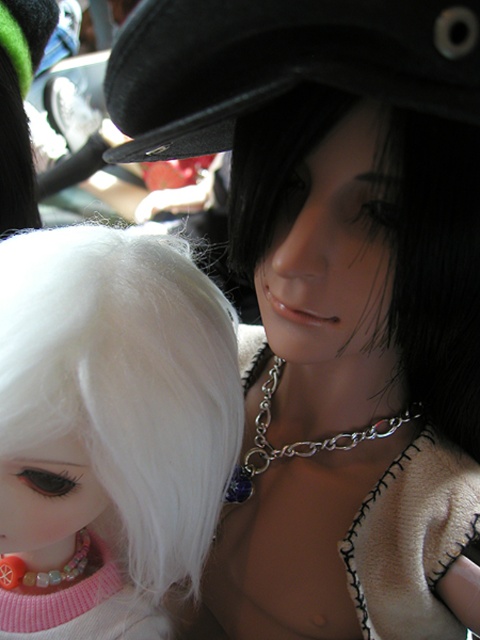
Between point (95, 486) and point (276, 312), which one is positioned in front?

Point (95, 486)

At what (x,y) coordinates should I click in order to perform the action: click on white matte wig at left. Please return your answer as a coordinate pair (x, y). The image size is (480, 640). Looking at the image, I should click on (108, 429).

Describe the element at coordinates (280, 64) in the screenshot. This screenshot has width=480, height=640. I see `black leather hat at upper center` at that location.

Identify the location of black leather hat at upper center. pos(280,64).

In the scene shown: Does black matte hair at center have a greater height compared to multicolored plastic teething ring at lower left?

Yes, black matte hair at center is taller than multicolored plastic teething ring at lower left.

This screenshot has height=640, width=480. Describe the element at coordinates (432, 262) in the screenshot. I see `black matte hair at center` at that location.

What do you see at coordinates (432, 262) in the screenshot?
I see `black matte hair at center` at bounding box center [432, 262].

At what (x,y) coordinates should I click in order to perform the action: click on black matte hair at center. Please return your answer as a coordinate pair (x, y). This screenshot has height=640, width=480. Looking at the image, I should click on (432, 262).